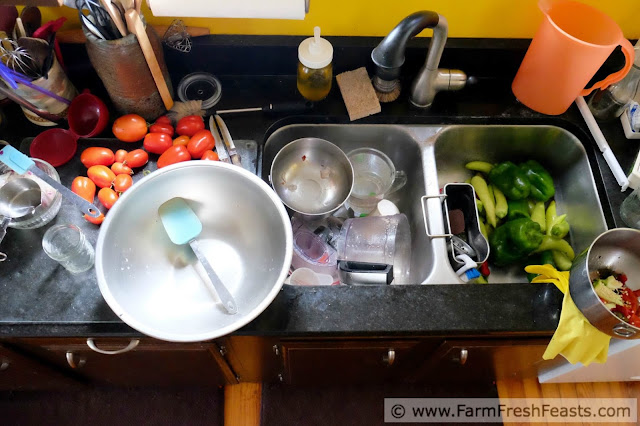
This screenshot has width=640, height=426. I want to click on faucet, so click(390, 53).